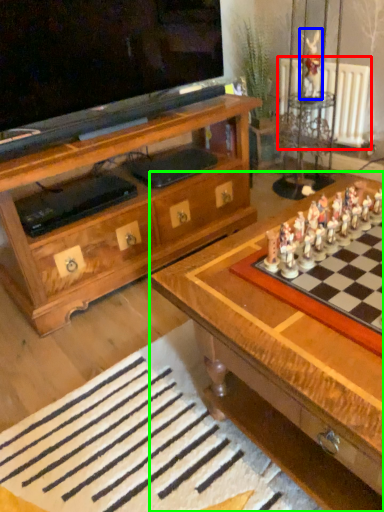
Question: Which object is the farthest from radiator (highlighted by a red box)? Choose among these: toy (highlighted by a blue box) or table (highlighted by a green box).

Choices:
 (A) toy
 (B) table

Answer: (B)